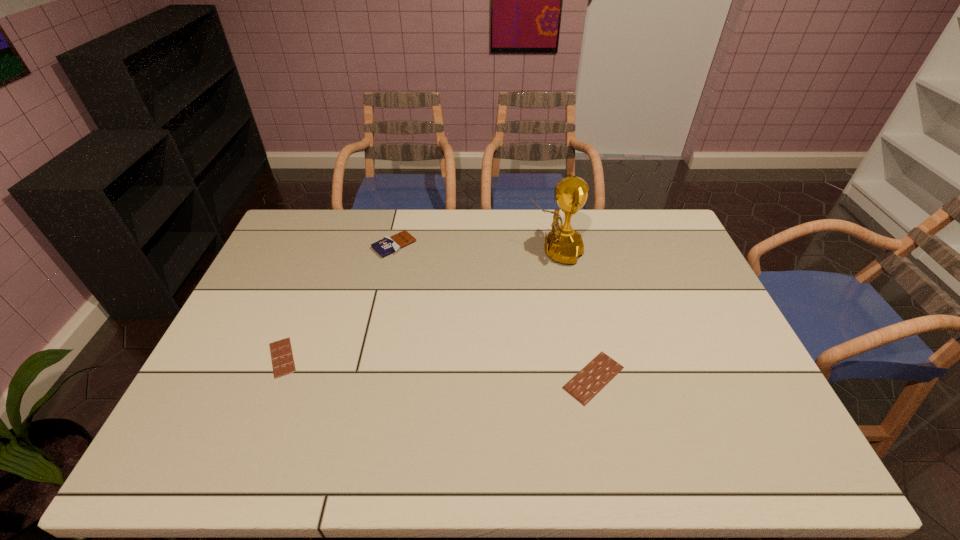
Locate an element on the screen. vacant space located on the left of the tallest chocolate bar is located at coordinates (355, 245).

Find the location of a particular element. vacant area located on the left of the second shortest chocolate bar is located at coordinates (540, 377).

Find the location of a particular element. The image size is (960, 540). vacant space located on the back of the shortest object is located at coordinates (304, 302).

Where is `award located at the far edge`? The width and height of the screenshot is (960, 540). award located at the far edge is located at coordinates (563, 244).

You are a GUI agent. You are given a task and a screenshot of the screen. Output one action in this format:
    pyautogui.click(x=<x>, y=<y>)
    Task: Click on the chocolate bar positioned at the far edge
    
    Given the screenshot: What is the action you would take?
    pyautogui.click(x=387, y=245)

Identify the location of object at the left edge. (282, 358).

Where is `vacant space at the far edge of the desktop`? vacant space at the far edge of the desktop is located at coordinates (451, 213).

The height and width of the screenshot is (540, 960). In the image, there is a desktop. In order to click on free space at the near edge in this screenshot , I will do `click(617, 435)`.

Where is `free space at the left edge of the desktop`? The image size is (960, 540). free space at the left edge of the desktop is located at coordinates [271, 280].

Identify the location of free space at the far right corner. (662, 235).